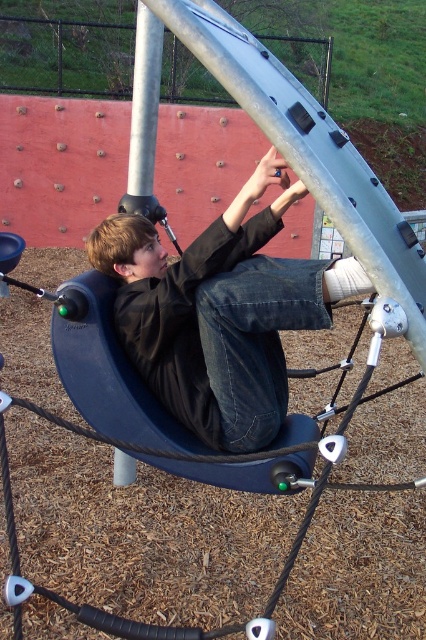
Question: Does matte black jacket at center have a smaller size compared to silver metallic pole at upper center?

Choices:
 (A) yes
 (B) no

Answer: (B)

Question: Which point is closer to the camera?

Choices:
 (A) silver metallic pole at upper center
 (B) matte black jacket at center

Answer: (B)

Question: Which object appears closest to the camera in this image?

Choices:
 (A) matte black jacket at center
 (B) silver metallic pole at upper center

Answer: (A)

Question: Is matte black jacket at center to the right of silver metallic pole at upper center from the viewer's perspective?

Choices:
 (A) no
 (B) yes

Answer: (B)

Question: Among these objects, which one is nearest to the camera?

Choices:
 (A) matte black jacket at center
 (B) silver metallic pole at upper center

Answer: (A)

Question: Is matte black jacket at center to the left of silver metallic pole at upper center from the viewer's perspective?

Choices:
 (A) no
 (B) yes

Answer: (A)